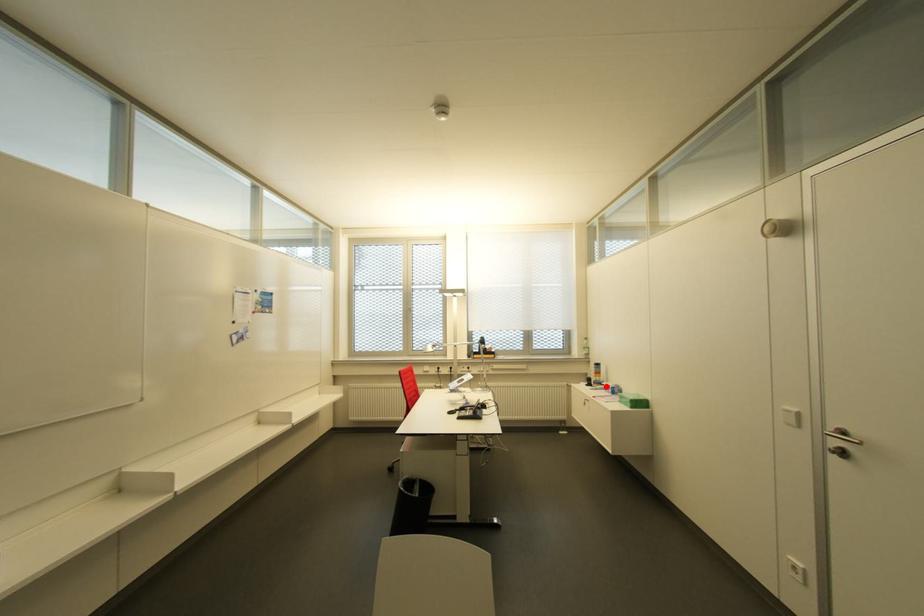
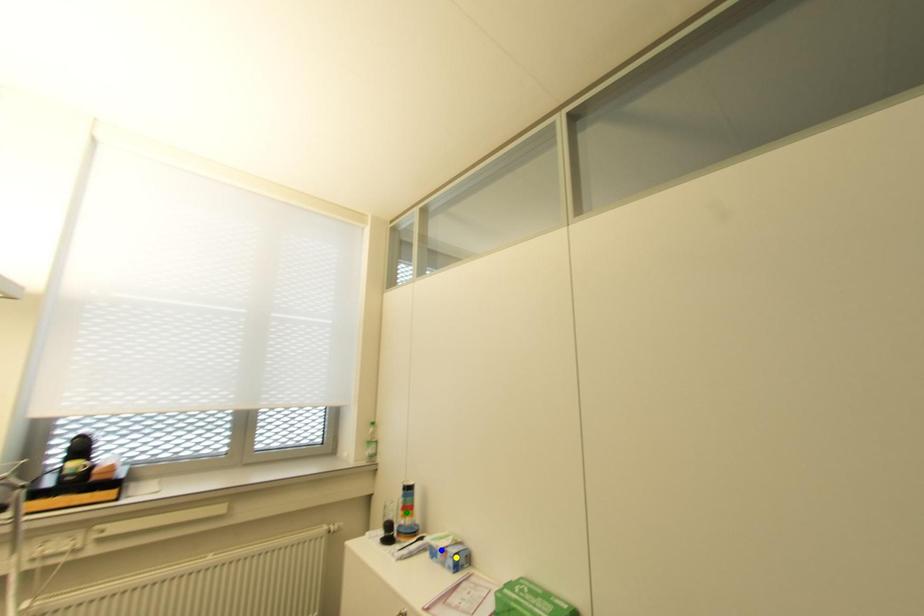
Question: I am providing you with two images of the same scene from different viewpoints. A red point is marked on the first image. You are given multiple points on the second image. Which spot in image 2 lines up with the point in image 1?

Choices:
 (A) yellow point
 (B) blue point
 (C) green point

Answer: (B)